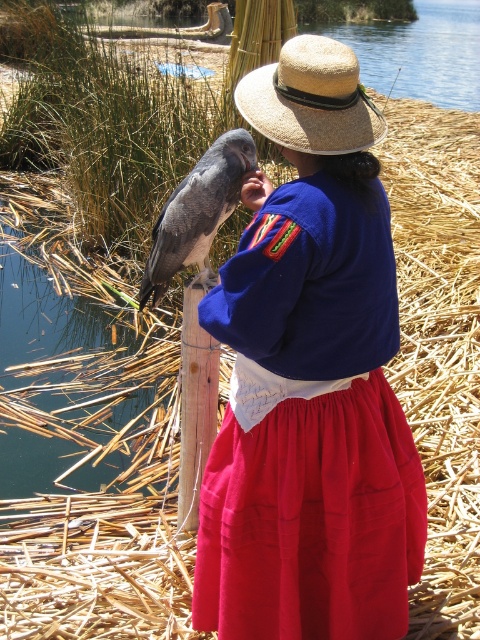
Image resolution: width=480 pixels, height=640 pixels. What do you see at coordinates (311, 99) in the screenshot?
I see `straw hat at center` at bounding box center [311, 99].

Who is higher up, straw hat at center or wooden post at center?

straw hat at center

Is point (346, 120) in front of point (193, 486)?

Yes, point (346, 120) is in front of point (193, 486).

The height and width of the screenshot is (640, 480). I want to click on straw hat at center, so click(311, 99).

Can you confirm if straw hat at center is positioned to the left of dark gray feathers at center?

No, straw hat at center is not to the left of dark gray feathers at center.

Between point (316, 108) and point (206, 284), which one is positioned in front?

Point (316, 108) is in front.

The height and width of the screenshot is (640, 480). Find the location of `straw hat at center`. straw hat at center is located at coordinates point(311,99).

Is point (208, 148) in front of point (182, 460)?

That is False.

Is point (186, 177) farther from camera compared to point (180, 474)?

Yes.

Where is `dark gray feathers at center`? The image size is (480, 640). dark gray feathers at center is located at coordinates (196, 214).